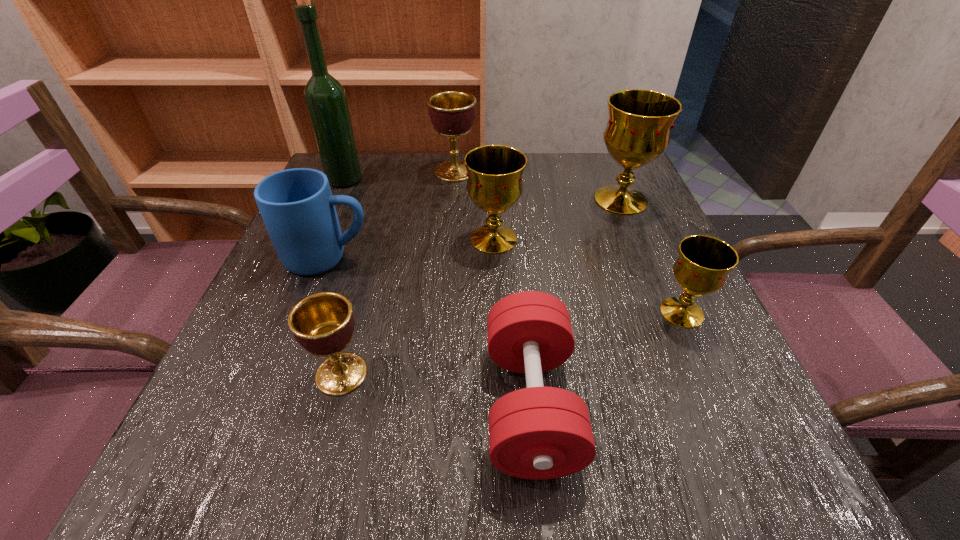
Where is `liquor`? The height and width of the screenshot is (540, 960). liquor is located at coordinates (325, 97).

What are the coordinates of `green liquor` in the screenshot? It's located at (325, 97).

Where is `the biggest gold chalice`? the biggest gold chalice is located at coordinates (638, 130).

Locate an element on the screen. the tallest chalice is located at coordinates (x=638, y=130).

Where is `the right golden chalice`? the right golden chalice is located at coordinates (452, 113).

Locate an element on the screen. The image size is (960, 540). the bigger golden chalice is located at coordinates (452, 113).

Where is `the second farthest gold chalice`? This screenshot has height=540, width=960. the second farthest gold chalice is located at coordinates (494, 184).

You are a GUI agent. You are given a task and a screenshot of the screen. Output one action in this format:
    pyautogui.click(x=<x>, y=<y>)
    Task: Click on the third nearest chalice
    The image size is (960, 540).
    Given the screenshot: What is the action you would take?
    pyautogui.click(x=494, y=184)

Find the location of a particular element. The height and width of the screenshot is (540, 960). mug is located at coordinates (297, 207).

Where is `the smallest gold chalice`? the smallest gold chalice is located at coordinates (703, 264).